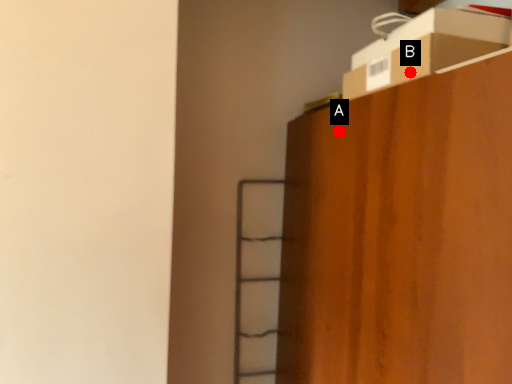
Question: Two points are circled on the image, labeled by A and B beside each circle. Which of the following is the farthest from the observer?

Choices:
 (A) A is further
 (B) B is further

Answer: (A)